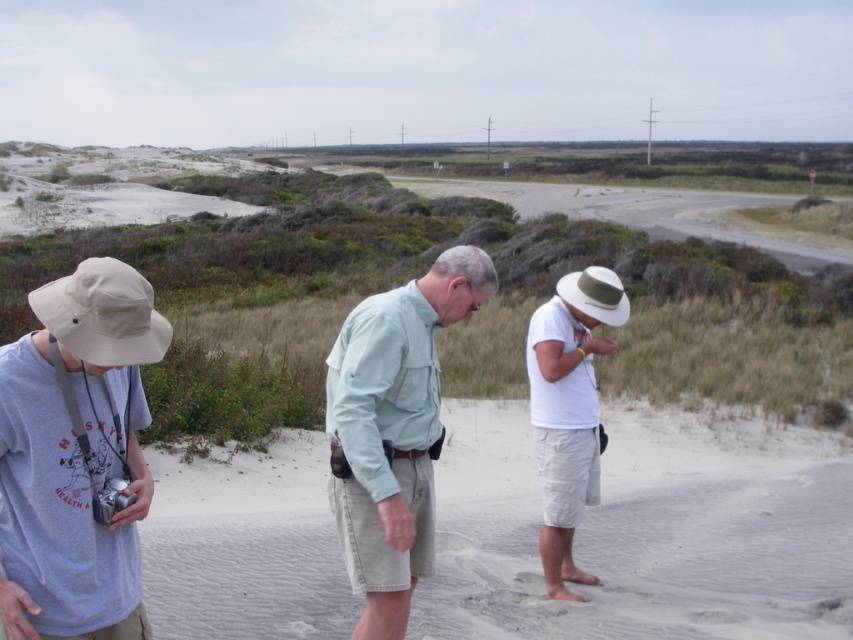
You are standing at the center of the sandy terrain and want to find the light beige fabric hat at left. In which direction should you look to locate it?

The light beige fabric hat at left is located at point 0.713 on the x and 0.090 on the y, so you should look to the right since the x coordinate is higher than 0.5, indicating it is on the right side of the image.